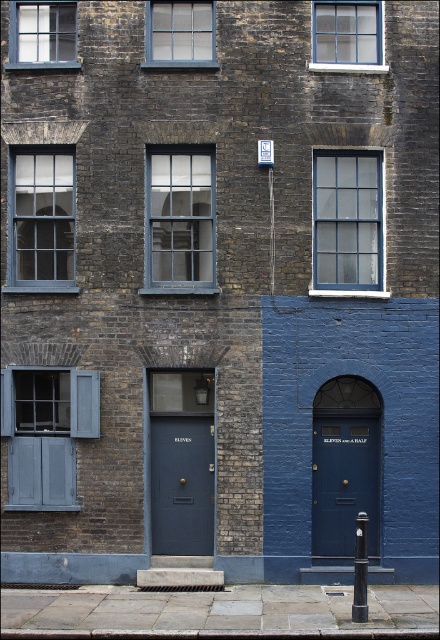
Question: Does matte blue door at center have a lesser width compared to matte glass window at upper left?

Choices:
 (A) no
 (B) yes

Answer: (B)

Question: Is matte gray window at upper left thinner than matte gray shutters at left?

Choices:
 (A) no
 (B) yes

Answer: (B)

Question: Which object appears closest to the camera in this image?

Choices:
 (A) matte glass window at upper left
 (B) matte glass window at upper center
 (C) matte dark blue door at center

Answer: (B)

Question: Among these points, which one is farthest from the camera?

Choices:
 (A) (10, 33)
 (B) (172, 33)
 (C) (168, 541)

Answer: (B)

Question: Observing the image, what is the correct spatial positioning of matte blue door at center in reference to clear glass window at upper center?

Choices:
 (A) left
 (B) right

Answer: (A)

Question: Considering the real-world distances, which object is farthest from the matte glass window at upper left?

Choices:
 (A) matte glass window at upper center
 (B) matte gray window at center
 (C) clear glass window at upper center

Answer: (C)